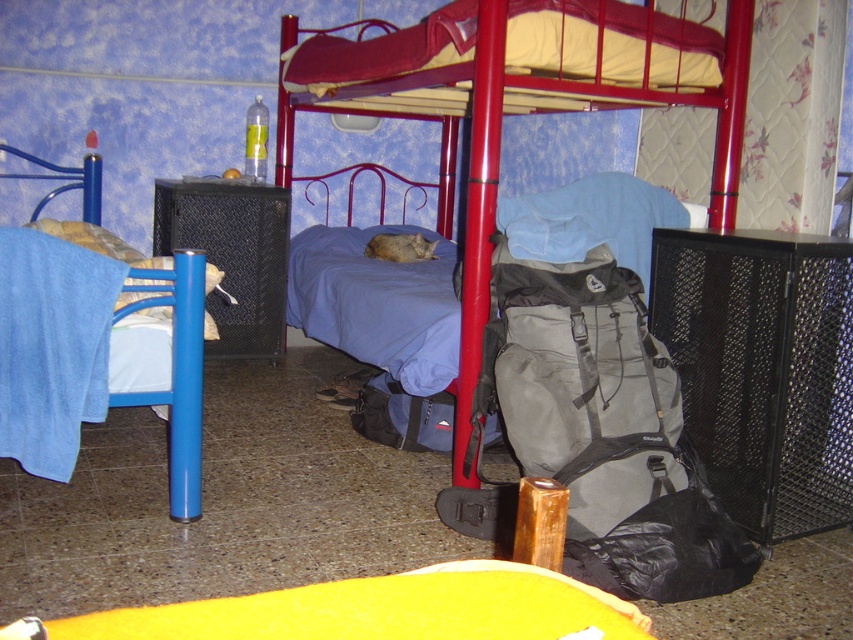
You are trying to fit a new twin mattress into the room. The twin mattress is 1.5 meters wide. Based on the image, can the twin mattress fit in the space between the metallic red bunk bed at center and the blue fabric bed at left?

The metallic red bunk bed at center might be wider than blue fabric bed at left, so the space between them may not be sufficient to accommodate the twin mattress which is 1.5 meters wide. You should measure the exact distance before deciding.

You are moving into this room and need to place a large piece of furniture that requires a space as big as the metallic red bunk bed at center. Is there enough space near the blue fabric bed at left to fit it?

The metallic red bunk bed at center has a larger size compared to blue fabric bed at left. Since the blue fabric bed at left is smaller, there might not be enough space near it to fit a piece of furniture as large as the metallic red bunk bed at center.